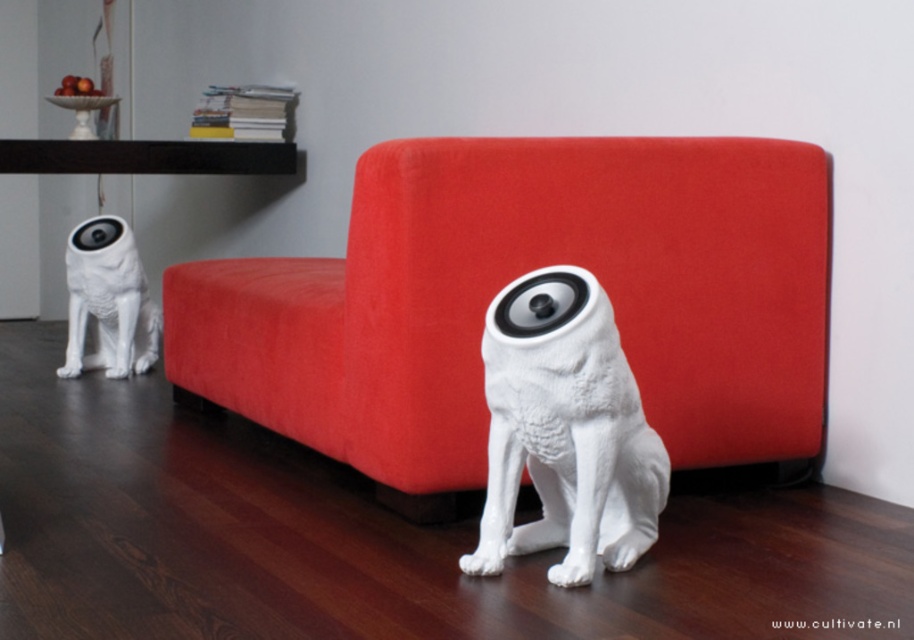
You are standing in the living room and want to place a small potted plant exactly at the point marked as point (512, 278). Is this location on the red velvet couch at center?

Yes, the point (512, 278) is on the red velvet couch at center, so placing the plant there would require placing it directly on the couch.

You are a painter standing in front of the red velvet couch at center and the white matte dog at lower left. You want to paint a mural on the wall behind the taller object. Which object should you stand behind to ensure the wall is visible?

The red velvet couch at center is taller than the white matte dog at lower left. Therefore, you should stand behind the red velvet couch at center to ensure the wall behind it is visible for painting the mural.

You are a person who is 1.7 meters tall. You want to sit on the red velvet couch at center. Can you comfortably reach the floor from the couch? The couch is 1.89 meters away from you. Please consider the average distance between a person and the couch when sitting.

The red velvet couch at center is 1.89 meters away from the viewer. Since the average sitting distance is about 0.5 meters, the 1.89 meters distance suggests the couch is too far away for you to comfortably reach the floor while sitting. You might need to stretch or move closer.